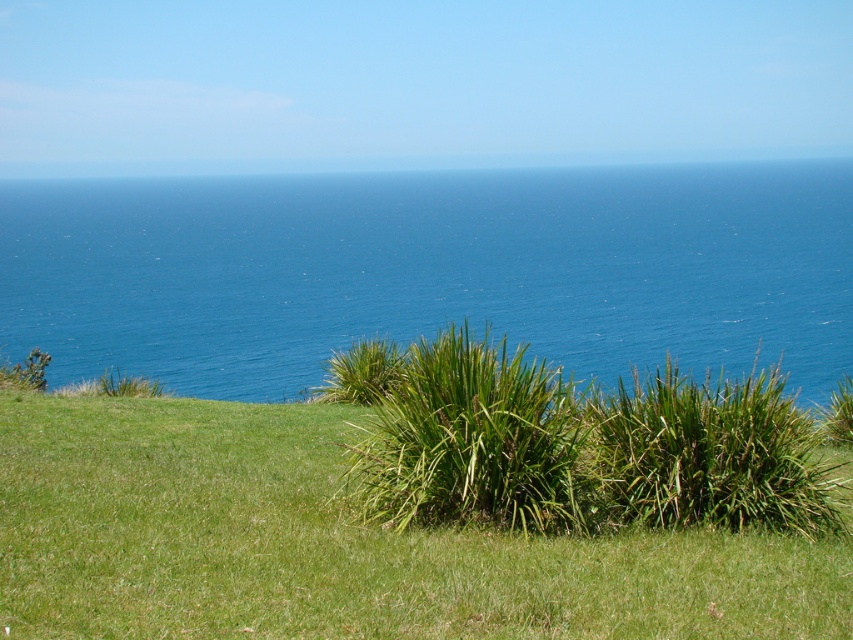
Question: Based on their relative distances, which object is nearer to the green leafy shrub at center?

Choices:
 (A) green grassy at lower center
 (B) blue water at center

Answer: (A)

Question: Which point is farther from the camera taking this photo?

Choices:
 (A) (521, 525)
 (B) (605, 282)
 (C) (553, 589)

Answer: (B)

Question: Which point is closer to the camera?

Choices:
 (A) (631, 289)
 (B) (560, 524)

Answer: (B)

Question: Can you confirm if blue water at center is positioned below green grassy at lower center?

Choices:
 (A) yes
 (B) no

Answer: (B)

Question: Does blue water at center appear under green leafy shrub at center?

Choices:
 (A) no
 (B) yes

Answer: (A)

Question: Can you confirm if blue water at center is thinner than green leafy shrub at center?

Choices:
 (A) yes
 (B) no

Answer: (B)